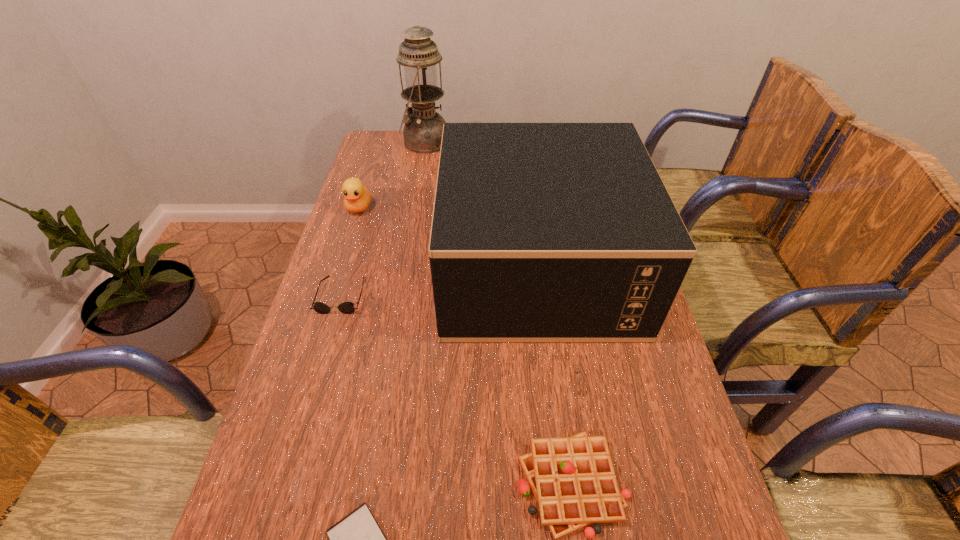
At what (x,y) coordinates should I click in order to perform the action: click on vacant space in between the tallest object and the sunglasses. Please return your answer as a coordinate pair (x, y). The width and height of the screenshot is (960, 540). Looking at the image, I should click on (383, 219).

This screenshot has width=960, height=540. I want to click on empty space between the sunglasses and the third tallest object, so click(350, 252).

This screenshot has height=540, width=960. What are the coordinates of `empty location between the sunglasses and the fourth shortest object` in the screenshot? It's located at (350, 252).

You are a GUI agent. You are given a task and a screenshot of the screen. Output one action in this format:
    pyautogui.click(x=<x>, y=<y>)
    Task: Click on the vacant area that lies between the oil lamp and the third tallest object
    
    Given the screenshot: What is the action you would take?
    pyautogui.click(x=392, y=175)

Point out which object is positioned as the second nearest to the box. Please provide its 2D coordinates. Your answer should be formatted as a tuple, i.e. [(x, y)], where the tuple contains the x and y coordinates of a point satisfying the conditions above.

[(572, 478)]

Select which object is the third closest to the duckling. Please provide its 2D coordinates. Your answer should be formatted as a tuple, i.e. [(x, y)], where the tuple contains the x and y coordinates of a point satisfying the conditions above.

[(423, 128)]